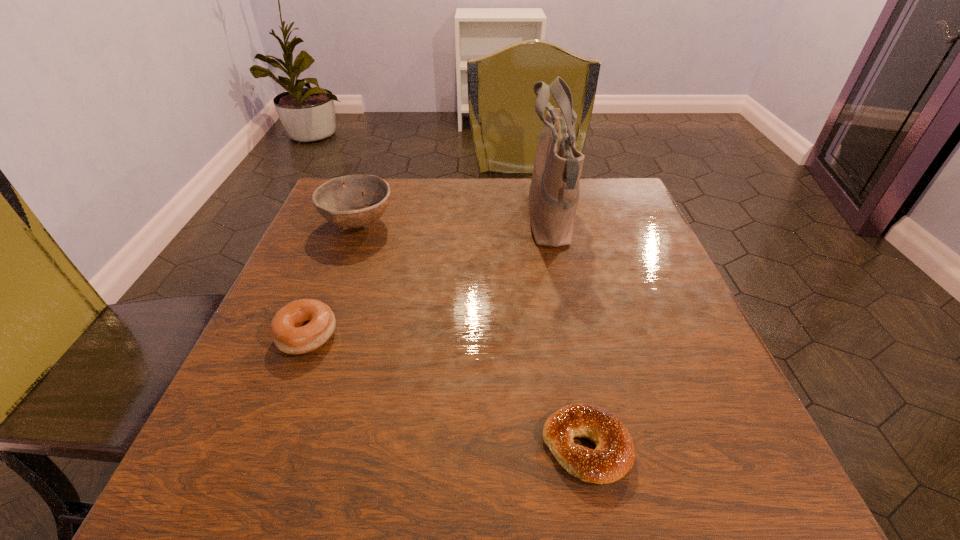
You are a GUI agent. You are given a task and a screenshot of the screen. Output one action in this format:
    pyautogui.click(x=<x>, y=<y>)
    Task: Click on the empty location between the tallest object and the farther bagel
    Image resolution: width=960 pixels, height=540 pixels.
    Given the screenshot: What is the action you would take?
    pyautogui.click(x=428, y=279)

I want to click on empty location between the nearest object and the bowl, so tap(472, 335).

The width and height of the screenshot is (960, 540). I want to click on vacant area that lies between the shoulder bag and the second shortest object, so click(x=428, y=279).

Identify which object is the second closest to the bowl. Please provide its 2D coordinates. Your answer should be formatted as a tuple, i.e. [(x, y)], where the tuple contains the x and y coordinates of a point satisfying the conditions above.

[(554, 191)]

Identify which object is located as the second nearest to the shorter bagel. Please provide its 2D coordinates. Your answer should be formatted as a tuple, i.e. [(x, y)], where the tuple contains the x and y coordinates of a point satisfying the conditions above.

[(554, 191)]

Identify the location of free space that satisfies the following two spatial constraints: 1. on the front side of the nearest object; 2. on the left side of the bowl. (276, 447).

This screenshot has height=540, width=960. Find the location of `vacant position in the image that satisfies the following two spatial constraints: 1. on the front-facing side of the tallest object; 2. on the front side of the taller bagel`. vacant position in the image that satisfies the following two spatial constraints: 1. on the front-facing side of the tallest object; 2. on the front side of the taller bagel is located at coordinates (574, 335).

Find the location of a particular element. The image size is (960, 540). free space that satisfies the following two spatial constraints: 1. on the back side of the taller bagel; 2. on the left side of the bowl is located at coordinates (351, 223).